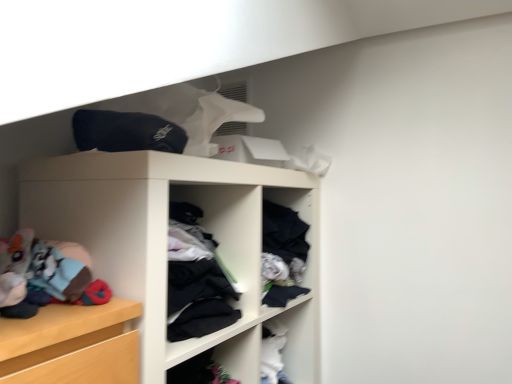
Question: Should I look upward or downward to see black matte cap at upper center?

Choices:
 (A) up
 (B) down

Answer: (A)

Question: Is white matte shelf at center inside black matte cap at upper center?

Choices:
 (A) yes
 (B) no

Answer: (B)

Question: From a real-world perspective, is black matte cap at upper center physically above white matte shelf at center?

Choices:
 (A) no
 (B) yes

Answer: (B)

Question: Is black matte cap at upper center positioned with its back to white matte shelf at center?

Choices:
 (A) yes
 (B) no

Answer: (B)

Question: Is the depth of black matte cap at upper center greater than that of white matte shelf at center?

Choices:
 (A) no
 (B) yes

Answer: (B)

Question: Can we say black matte cap at upper center lies outside white matte shelf at center?

Choices:
 (A) no
 (B) yes

Answer: (B)

Question: Is black matte cap at upper center shorter than white matte shelf at center?

Choices:
 (A) no
 (B) yes

Answer: (B)

Question: From the image's perspective, does white matte shelf at center appear higher than black matte cap at upper center?

Choices:
 (A) no
 (B) yes

Answer: (A)

Question: Is white matte shelf at center in contact with black matte cap at upper center?

Choices:
 (A) yes
 (B) no

Answer: (B)

Question: Considering the relative sizes of white matte shelf at center and black matte cap at upper center in the image provided, is white matte shelf at center bigger than black matte cap at upper center?

Choices:
 (A) no
 (B) yes

Answer: (B)

Question: Does white matte shelf at center have a greater width compared to black matte cap at upper center?

Choices:
 (A) no
 (B) yes

Answer: (B)

Question: Considering the relative sizes of white matte shelf at center and black matte cap at upper center in the image provided, is white matte shelf at center taller than black matte cap at upper center?

Choices:
 (A) no
 (B) yes

Answer: (B)

Question: Does white matte shelf at center have a lesser height compared to black matte cap at upper center?

Choices:
 (A) no
 (B) yes

Answer: (A)

Question: From the image's perspective, is black matte cap at upper center located above or below white matte shelf at center?

Choices:
 (A) below
 (B) above

Answer: (B)